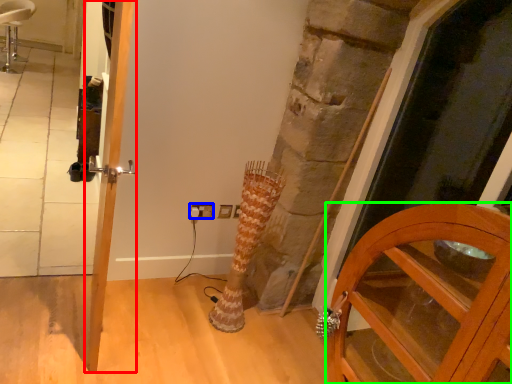
Question: Which object is the closest to the door (highlighted by a red box)? Choose among these: electric outlet (highlighted by a blue box) or cabinetry (highlighted by a green box).

Choices:
 (A) electric outlet
 (B) cabinetry

Answer: (A)